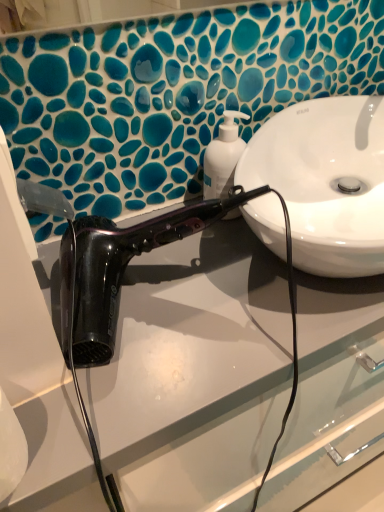
You are a GUI agent. You are given a task and a screenshot of the screen. Output one action in this format:
    pyautogui.click(x=<x>, y=<y>)
    Task: Click on the vacant space in front of white glossy soap dispenser at center
    
    Given the screenshot: What is the action you would take?
    pyautogui.click(x=218, y=263)